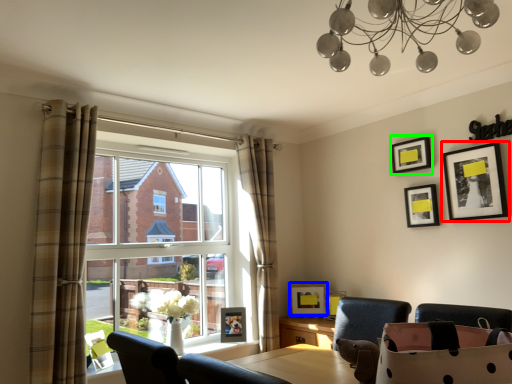
Question: Which object is the closest to the picture frame (highlighted by a red box)? Choose among these: picture frame (highlighted by a blue box) or picture frame (highlighted by a green box).

Choices:
 (A) picture frame
 (B) picture frame

Answer: (B)